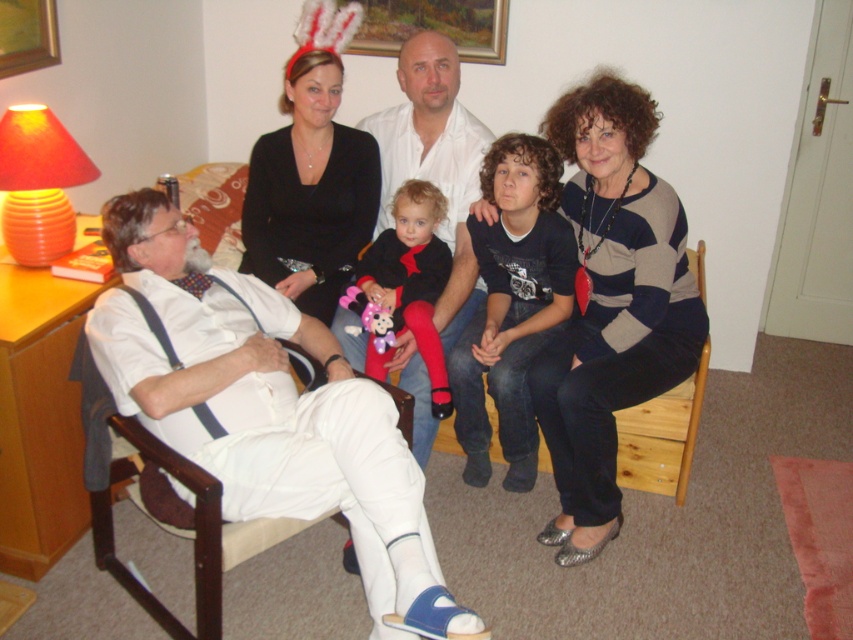
Question: Is striped sweater at center to the left of velvet plush toy at center from the viewer's perspective?

Choices:
 (A) no
 (B) yes

Answer: (A)

Question: Considering the real-world distances, which object is farthest from the dark blue cotton shirt at center?

Choices:
 (A) white matte clothing at center
 (B) smooth white shirt at center
 (C) velvet plush toy at center
 (D) wooden chair at right

Answer: (D)

Question: Which object appears closest to the camera in this image?

Choices:
 (A) striped sweater at center
 (B) plush pink toy at center
 (C) smooth white shirt at center

Answer: (A)

Question: Estimate the real-world distances between objects in this image. Which object is closer to the wooden chair at right?

Choices:
 (A) striped sweater at center
 (B) wooden chair at left
 (C) dark blue cotton shirt at center

Answer: (A)

Question: Does wooden chair at left have a smaller size compared to velvet plush toy at center?

Choices:
 (A) yes
 (B) no

Answer: (B)

Question: Is velvet plush toy at center positioned behind wooden chair at right?

Choices:
 (A) yes
 (B) no

Answer: (A)